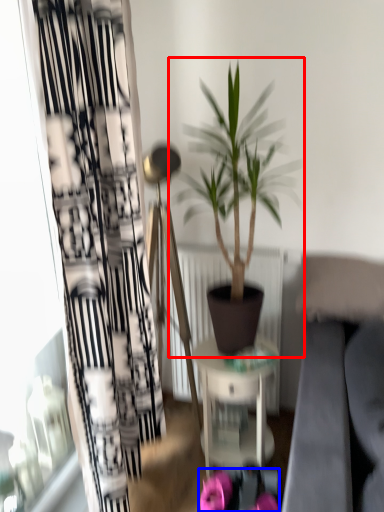
Question: Which object appears farthest to the camera in this image, houseplant (highlighted by a red box) or flower (highlighted by a blue box)?

Choices:
 (A) houseplant
 (B) flower

Answer: (B)